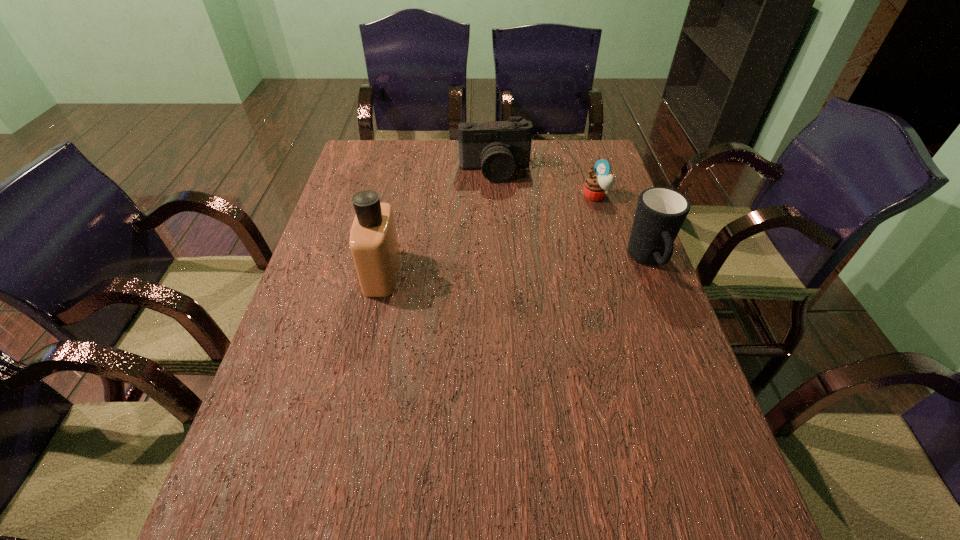
Where is `the leftmost object`? the leftmost object is located at coordinates (373, 242).

This screenshot has height=540, width=960. Identify the location of perfume. (373, 242).

Identify the location of mug. This screenshot has height=540, width=960. (660, 213).

Locate an element on the screen. This screenshot has height=540, width=960. the shortest object is located at coordinates (596, 187).

This screenshot has width=960, height=540. What are the coordinates of `muffin` in the screenshot? It's located at (596, 187).

The height and width of the screenshot is (540, 960). Identify the location of the second object from left to right. (499, 147).

At what (x,y) coordinates should I click in order to perform the action: click on the farthest object. Please return your answer as a coordinate pair (x, y). Looking at the image, I should click on (499, 147).

The width and height of the screenshot is (960, 540). In order to click on vacant space located on the front label of the tallest object in this screenshot , I will do `click(324, 273)`.

The image size is (960, 540). In order to click on free space located on the side of the mug with the handle in this screenshot , I will do `click(688, 366)`.

In order to click on free space located 0.240m on the front-facing side of the muffin in this screenshot , I will do `click(546, 241)`.